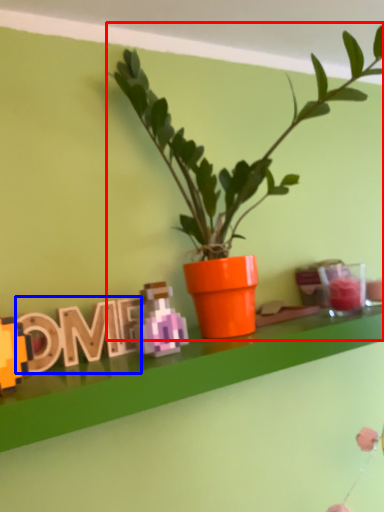
Question: Which of the following is the farthest to the observer, houseplant (highlighted by a red box) or alphabet (highlighted by a blue box)?

Choices:
 (A) houseplant
 (B) alphabet

Answer: (B)